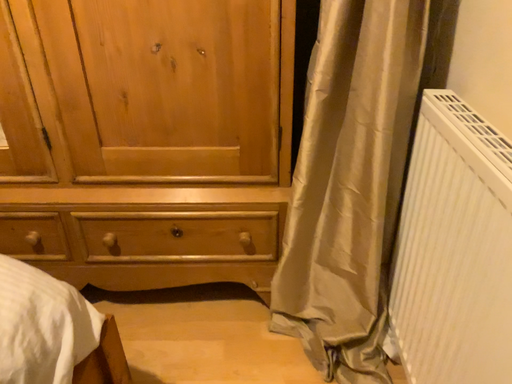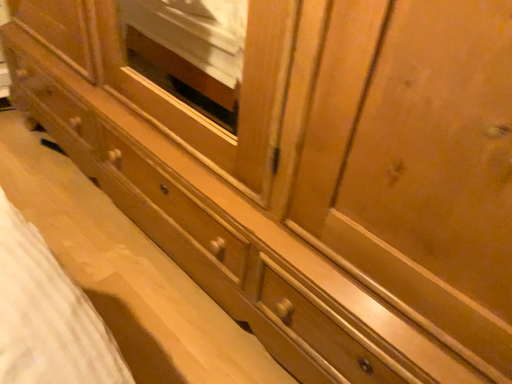
Question: Which way did the camera rotate in the video?

Choices:
 (A) rotated right
 (B) rotated left

Answer: (B)